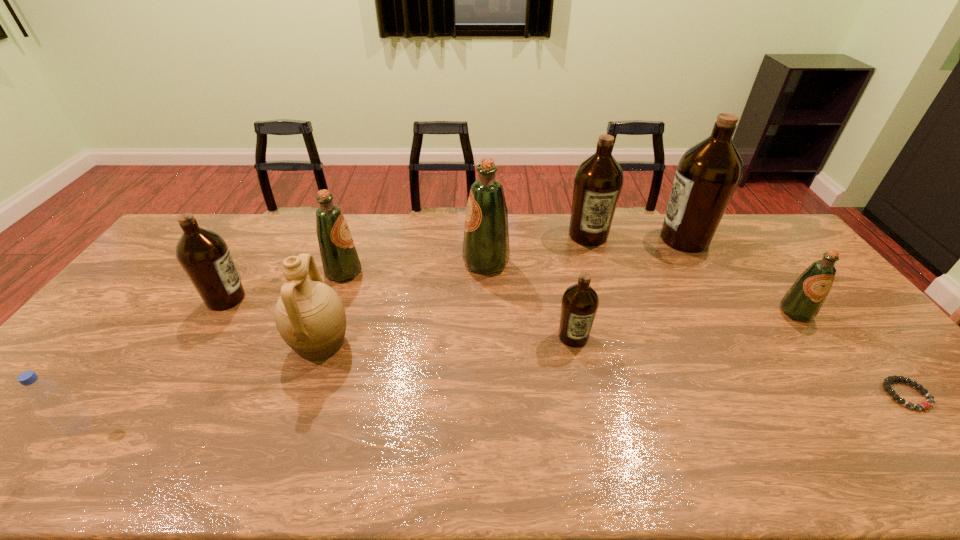
This screenshot has height=540, width=960. Find the location of `blank area located on the label of the rightmost brown olive oil`. blank area located on the label of the rightmost brown olive oil is located at coordinates (608, 239).

Where is `free space located on the label of the rightmost brown olive oil`? free space located on the label of the rightmost brown olive oil is located at coordinates (588, 239).

The width and height of the screenshot is (960, 540). What are the coordinates of `vacant point located 0.400m on the label of the fifth olive oil from left to right` in the screenshot? It's located at (619, 334).

The height and width of the screenshot is (540, 960). I want to click on vacant space located on the front-facing side of the fifth olive oil from right to left, so click(x=448, y=263).

Image resolution: width=960 pixels, height=540 pixels. In order to click on vacant space located 0.350m on the front-facing side of the fifth olive oil from right to left in this screenshot , I will do [x=359, y=263].

What are the coordinates of `free spot located on the front-facing side of the fifth olive oil from right to left` in the screenshot? It's located at (386, 263).

This screenshot has width=960, height=540. I want to click on blank space located on the front-facing side of the leftmost green olive oil, so click(420, 272).

This screenshot has height=540, width=960. What are the coordinates of `free space located 0.060m on the label of the third biggest brown olive oil` in the screenshot? It's located at (266, 299).

Locate an element on the screen. Image resolution: width=960 pixels, height=540 pixels. vacant space situated on the back of the pitcher is located at coordinates (339, 292).

The height and width of the screenshot is (540, 960). In order to click on vacant space located on the label of the smallest brown olive oil in this screenshot , I will do `click(594, 438)`.